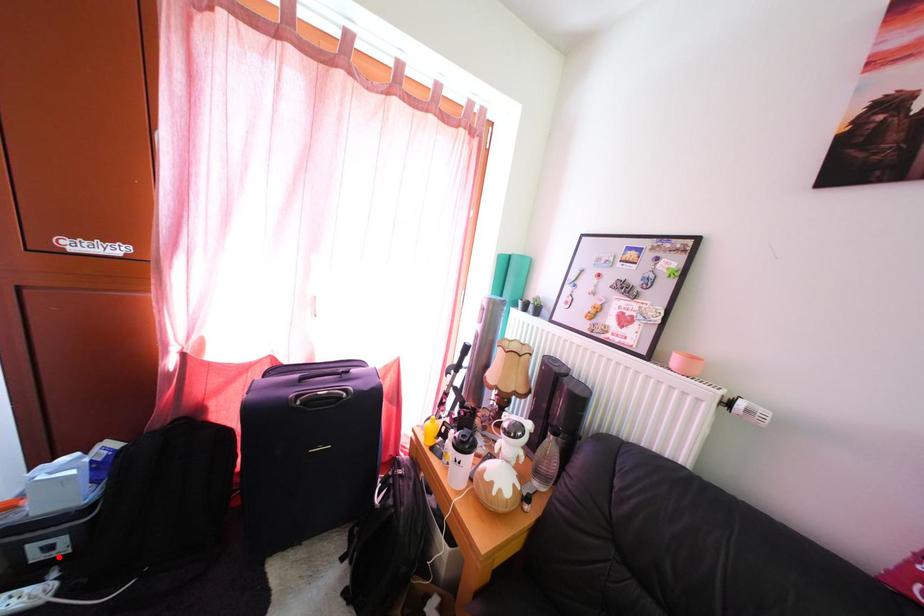
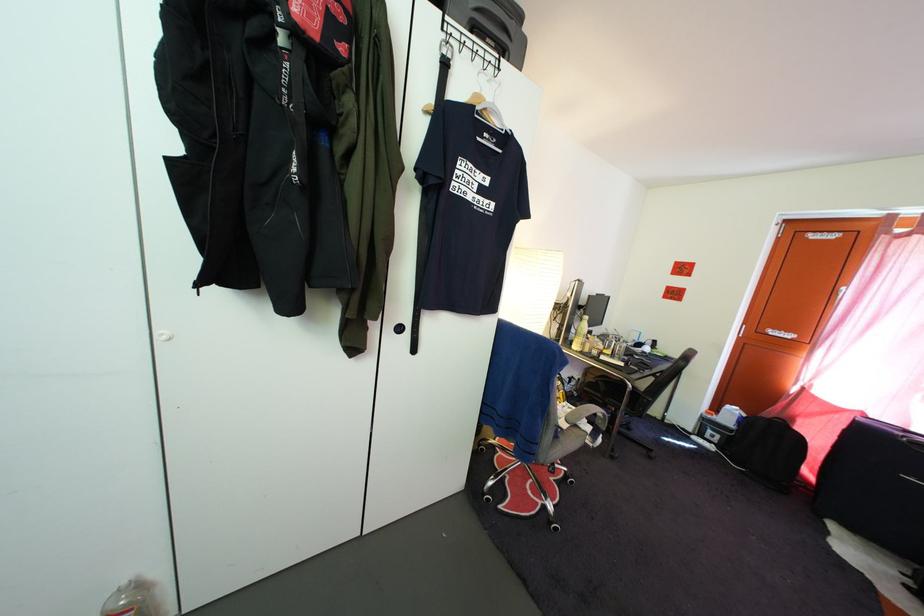
Locate, in the second image, the point that corresponds to the highlighted location in the first image.

(721, 445)